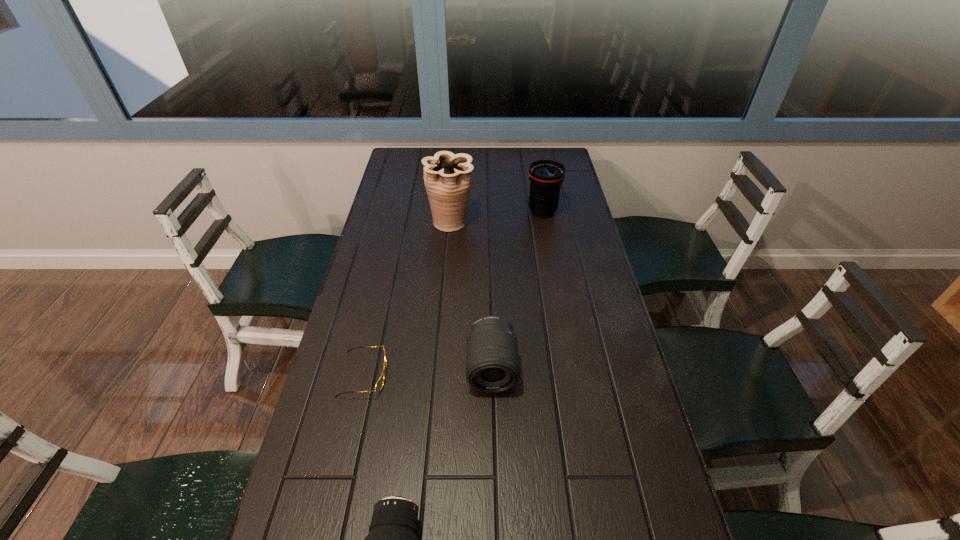
Locate an element on the screen. This screenshot has width=960, height=540. urn is located at coordinates (447, 177).

The height and width of the screenshot is (540, 960). Find the location of `the rightmost object`. the rightmost object is located at coordinates (546, 176).

You are a GUI agent. You are given a task and a screenshot of the screen. Output one action in this format:
    pyautogui.click(x=<x>, y=<y>)
    Task: Click on the tallest telephoto lens
    The height and width of the screenshot is (540, 960).
    Given the screenshot: What is the action you would take?
    pyautogui.click(x=546, y=176)

I want to click on the second telephoto lens from left to right, so click(x=492, y=362).

Find the location of a particular element. Image resolution: width=960 pixels, height=540 pixels. the second tallest telephoto lens is located at coordinates (492, 362).

At what (x,y) coordinates should I click in order to perform the action: click on the leftmost object. Please return your answer as a coordinate pair (x, y). Image resolution: width=960 pixels, height=540 pixels. Looking at the image, I should click on (380, 382).

Image resolution: width=960 pixels, height=540 pixels. I want to click on the shortest object, so click(380, 382).

At what (x,y) coordinates should I click in order to perform the action: click on vacant space located 0.260m on the back of the urn. Please return your answer as a coordinate pair (x, y). Image resolution: width=960 pixels, height=540 pixels. Looking at the image, I should click on (455, 172).

At what (x,y) coordinates should I click in order to perform the action: click on blank area located 0.250m on the back of the farthest telephoto lens. Please return your answer as a coordinate pair (x, y). The height and width of the screenshot is (540, 960). Looking at the image, I should click on (535, 168).

The image size is (960, 540). Identify the location of vacant space located on the surface of the second shortest telephoto lens. (495, 497).